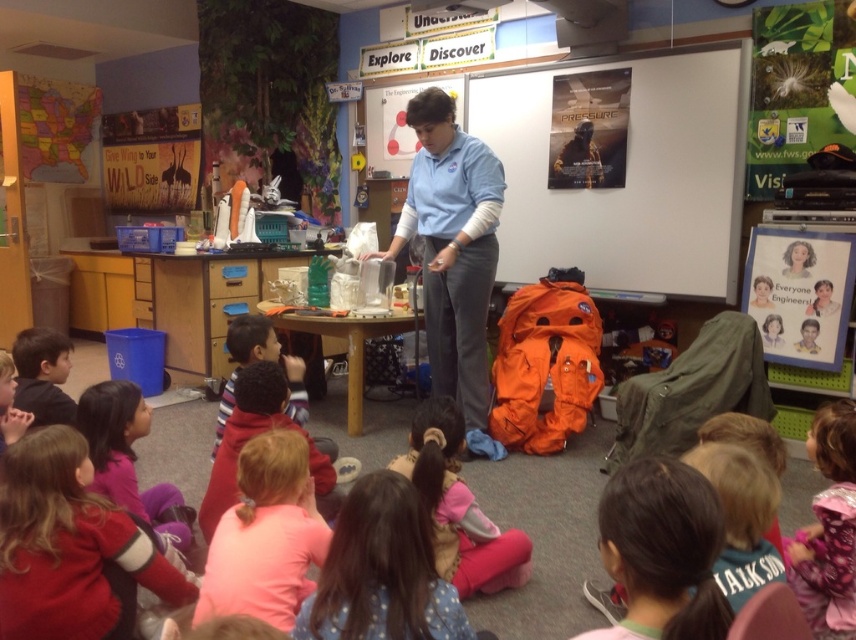
Is light blue shirt at center further to the viewer compared to dark brown hair at lower right?

Yes, light blue shirt at center is further from the viewer.

Between light blue shirt at center and dark brown hair at lower right, which one has less height?

dark brown hair at lower right

Between point (437, 257) and point (622, 488), which one is positioned behind?

The point (437, 257) is more distant.

Where is `light blue shirt at center`? This screenshot has width=856, height=640. light blue shirt at center is located at coordinates (452, 246).

From the picture: Is matte poster at upper right below dark brown hair at lower right?

No, matte poster at upper right is not below dark brown hair at lower right.

Looking at this image, does matte poster at upper right have a lesser height compared to dark brown hair at lower right?

No, matte poster at upper right is not shorter than dark brown hair at lower right.

Between point (693, 74) and point (660, 492), which one is positioned behind?

The point (693, 74) is more distant.

At what (x,y) coordinates should I click in order to perform the action: click on matte poster at upper right. Please return your answer as a coordinate pair (x, y). The image size is (856, 640). Looking at the image, I should click on [x=627, y=176].

Does light blue shirt at center have a lesser height compared to pink fleece jacket at lower center?

No, light blue shirt at center is not shorter than pink fleece jacket at lower center.

Who is more distant from viewer, (389, 252) or (462, 518)?

The point (389, 252) is more distant.

Does point (471, 157) come behind point (438, 428)?

Yes, it is behind point (438, 428).

The height and width of the screenshot is (640, 856). Identify the location of light blue shirt at center. (452, 246).